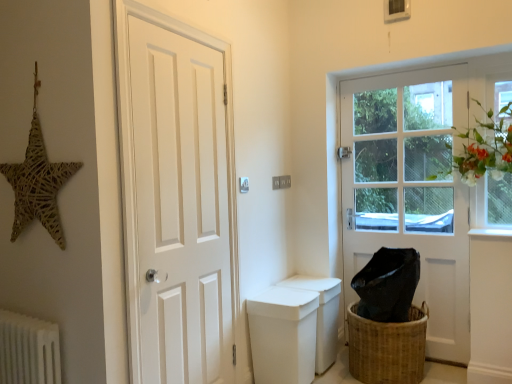
In order to face woven straw star at upper left, should I rotate leftwards or rightwards?

Turn left by 27.802 degrees to look at woven straw star at upper left.

Locate an element on the screen. The width and height of the screenshot is (512, 384). woven straw star at upper left is located at coordinates [38, 186].

What is the approximate width of white textured radiator at lower left?

It is 4.91 inches.

What do you see at coordinates (409, 190) in the screenshot? The width and height of the screenshot is (512, 384). I see `white wooden door at right, the 2th door viewed from the left` at bounding box center [409, 190].

The height and width of the screenshot is (384, 512). What are the coordinates of `clear glass window at upper right` in the screenshot? It's located at (490, 203).

What do you see at coordinates (490, 203) in the screenshot?
I see `clear glass window at upper right` at bounding box center [490, 203].

Describe the element at coordinates (490, 232) in the screenshot. This screenshot has width=512, height=384. I see `white smooth window sill at lower right` at that location.

Consider the image. In order to face white smooth window sill at lower right, should I rotate leftwards or rightwards?

Turn right by 28.896 degrees to look at white smooth window sill at lower right.

This screenshot has height=384, width=512. In order to click on white matte toilet bowl at center in this screenshot , I will do `click(283, 335)`.

The image size is (512, 384). I want to click on woven straw star at upper left, so click(38, 186).

Does clear glass window at upper right have a larger size compared to white textured radiator at lower left?

No.

Considering the relative positions of clear glass window at upper right and white textured radiator at lower left in the image provided, is clear glass window at upper right in front of white textured radiator at lower left?

No, it is behind white textured radiator at lower left.

Considering the relative positions of clear glass window at upper right and white textured radiator at lower left in the image provided, is clear glass window at upper right to the left of white textured radiator at lower left from the viewer's perspective?

In fact, clear glass window at upper right is to the right of white textured radiator at lower left.

From a real-world perspective, is clear glass window at upper right located higher than white textured radiator at lower left?

Correct, in the physical world, clear glass window at upper right is higher than white textured radiator at lower left.

Considering the sizes of woven brown basket at lower right and white textured radiator at lower left in the image, is woven brown basket at lower right wider or thinner than white textured radiator at lower left?

woven brown basket at lower right is wider than white textured radiator at lower left.

From a real-world perspective, relative to white textured radiator at lower left, is woven brown basket at lower right vertically above or below?

Clearly, from a real-world perspective, woven brown basket at lower right is below white textured radiator at lower left.

Is woven brown basket at lower right facing away from white textured radiator at lower left?

woven brown basket at lower right is not turned away from white textured radiator at lower left.

Could white textured radiator at lower left be considered to be inside woven brown basket at lower right?

That's incorrect, white textured radiator at lower left is not inside woven brown basket at lower right.

Between white matte door at left, the 2th door when ordered from right to left, and woven brown basket at lower right, which one has smaller size?

With smaller size is white matte door at left, the 2th door when ordered from right to left.

From the image's perspective, count 2nd doors upward from the woven brown basket at lower right and point to it. Please provide its 2D coordinates.

[(178, 210)]

From a real-world perspective, is white matte door at left, which is the 1th door in front-to-back order, beneath woven brown basket at lower right?

Actually, white matte door at left, which is the 1th door in front-to-back order, is physically above woven brown basket at lower right in the real world.

Considering the relative sizes of white matte door at left, the 2th door when ordered from right to left, and woven brown basket at lower right in the image provided, is white matte door at left, the 2th door when ordered from right to left, wider than woven brown basket at lower right?

In fact, white matte door at left, the 2th door when ordered from right to left, might be narrower than woven brown basket at lower right.

Are white matte door at left, arranged as the 2th door when viewed from the back, and white textured radiator at lower left located far from each other?

Actually, white matte door at left, arranged as the 2th door when viewed from the back, and white textured radiator at lower left are a little close together.

From a real-world perspective, which is physically below, white matte door at left, acting as the 1th door starting from the left, or white textured radiator at lower left?

white textured radiator at lower left is physically lower.

Which is more to the right, white matte door at left, arranged as the 2th door when viewed from the back, or white textured radiator at lower left?

white matte door at left, arranged as the 2th door when viewed from the back, is more to the right.

Where is `radiator on the left of white matte door at left, acting as the 1th door starting from the left`? radiator on the left of white matte door at left, acting as the 1th door starting from the left is located at coordinates (28, 350).

Can you tell me how much woven brown basket at lower right and white matte door at left, acting as the 1th door starting from the left, differ in facing direction?

The facing directions of woven brown basket at lower right and white matte door at left, acting as the 1th door starting from the left, are 92.3 degrees apart.

Identify the location of basket below the white matte door at left, the 2th door when ordered from right to left (from the image's perspective). This screenshot has height=384, width=512. (387, 347).

Measure the distance between woven brown basket at lower right and white matte door at left, which is the 1th door in front-to-back order.

The distance of woven brown basket at lower right from white matte door at left, which is the 1th door in front-to-back order, is 3.76 feet.

Is woven brown basket at lower right at the left side of white matte door at left, which is the 1th door in front-to-back order?

No, woven brown basket at lower right is not to the left of white matte door at left, which is the 1th door in front-to-back order.

Consider the image. Who is shorter, white matte door at left, acting as the 1th door starting from the left, or white wooden door at right, the 2th door viewed from the left?

Standing shorter between the two is white wooden door at right, the 2th door viewed from the left.

What's the angular difference between white matte door at left, the 2th door when ordered from right to left, and white wooden door at right, acting as the 1th door starting from the back,'s facing directions?

The angle between the facing direction of white matte door at left, the 2th door when ordered from right to left, and the facing direction of white wooden door at right, acting as the 1th door starting from the back, is 91.8 degrees.

Locate an element on the screen. This screenshot has height=384, width=512. door that is on the right side of white matte door at left, which is the 1th door in front-to-back order is located at coordinates (409, 190).

Would you consider white matte door at left, which is the 1th door in front-to-back order, to be distant from white wooden door at right, acting as the 1th door starting from the back?

Yes.

How many degrees apart are the facing directions of clear glass window at upper right and white matte toilet bowl at center?

clear glass window at upper right and white matte toilet bowl at center are facing 90.5 degrees away from each other.

Is clear glass window at upper right facing towards white matte toilet bowl at center?

No, clear glass window at upper right is not facing towards white matte toilet bowl at center.

Considering the relative sizes of clear glass window at upper right and white matte toilet bowl at center in the image provided, is clear glass window at upper right bigger than white matte toilet bowl at center?

Incorrect, clear glass window at upper right is not larger than white matte toilet bowl at center.

In the image, there is a clear glass window at upper right. Where is `radiator below it (from the image's perspective)`? radiator below it (from the image's perspective) is located at coordinates (28, 350).

The height and width of the screenshot is (384, 512). What are the coordinates of `radiator located on the left of woven brown basket at lower right` in the screenshot? It's located at (28, 350).

From the image, which object appears to be farther from white smooth window sill at lower right, white matte door at left, acting as the 1th door starting from the left, or white textured radiator at lower left?

Based on the image, white textured radiator at lower left appears to be further to white smooth window sill at lower right.

From the image, which object appears to be nearer to white matte door at left, acting as the 1th door starting from the left, clear glass window at upper right or white wooden door at right, acting as the 1th door starting from the back?

Among the two, white wooden door at right, acting as the 1th door starting from the back, is located nearer to white matte door at left, acting as the 1th door starting from the left.

From the image, which object appears to be nearer to white textured radiator at lower left, white matte door at left, the 2th door when ordered from right to left, or woven straw star at upper left?

woven straw star at upper left lies closer to white textured radiator at lower left than the other object.

Considering their positions, is woven brown basket at lower right positioned further to white matte toilet bowl at center than white smooth window sill at lower right?

Based on the image, white smooth window sill at lower right appears to be further to white matte toilet bowl at center.

In the scene shown: Estimate the real-world distances between objects in this image. Which object is further from white wooden door at right, acting as the 1th door starting from the back, clear glass window at upper right or white smooth window sill at lower right?

white smooth window sill at lower right is positioned further to the anchor white wooden door at right, acting as the 1th door starting from the back.

From the image, which object appears to be nearer to woven brown basket at lower right, white matte door at left, the 2th door when ordered from right to left, or white textured radiator at lower left?

white matte door at left, the 2th door when ordered from right to left, is positioned closer to the anchor woven brown basket at lower right.

Considering their positions, is woven straw star at upper left positioned closer to white smooth window sill at lower right than white textured radiator at lower left?

Among the two, woven straw star at upper left is located nearer to white smooth window sill at lower right.

Which object lies further to the anchor point white smooth window sill at lower right, white matte door at left, which is the 1th door in front-to-back order, or white wooden door at right, which is counted as the second door, starting from the front?

white matte door at left, which is the 1th door in front-to-back order.

Locate an element on the screen. The width and height of the screenshot is (512, 384). door between white textured radiator at lower left and white matte toilet bowl at center is located at coordinates (178, 210).

In order to click on toilet bowl between white wooden door at right, the 1th door in the right-to-left sequence, and woven brown basket at lower right in the up-down direction in this screenshot , I will do `click(283, 335)`.

I want to click on toilet bowl situated between woven straw star at upper left and clear glass window at upper right from left to right, so click(283, 335).

You are a GUI agent. You are given a task and a screenshot of the screen. Output one action in this format:
    pyautogui.click(x=<x>, y=<y>)
    Task: Click on the basket between white matte door at left, the 2th door when ordered from right to left, and clear glass window at upper right from left to right
    The width and height of the screenshot is (512, 384).
    Given the screenshot: What is the action you would take?
    pyautogui.click(x=387, y=347)